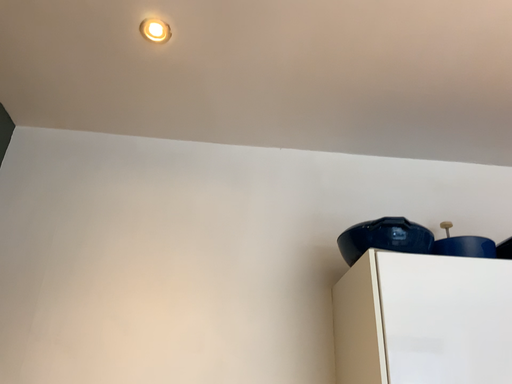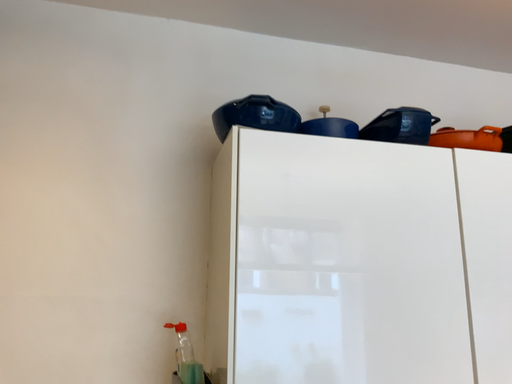
Question: How did the camera likely rotate when shooting the video?

Choices:
 (A) rotated upward
 (B) rotated downward

Answer: (B)